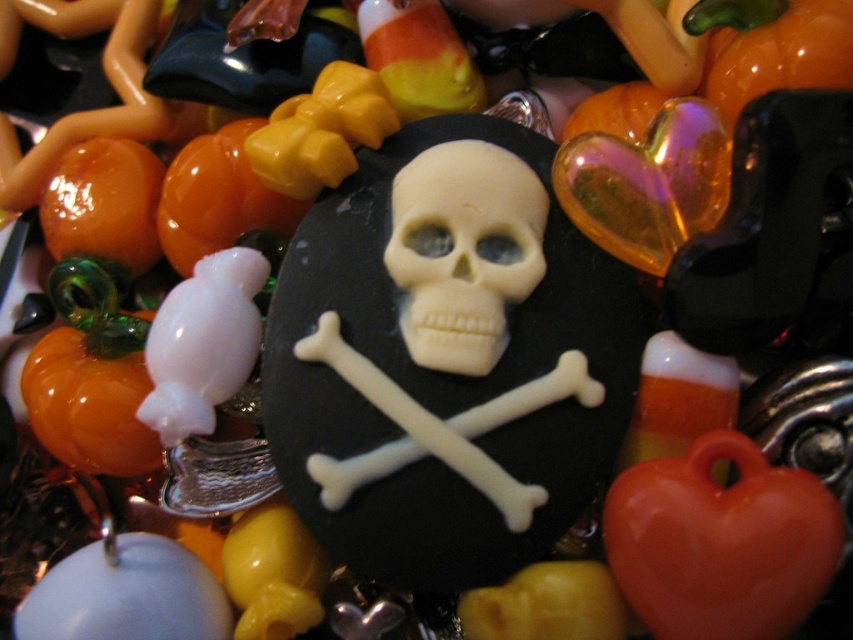
You are organizing a Halloween craft station and need to arrange beads by height. You have a glossy plastic heart at lower right and a white matte skull at center. Which bead should you place first if you want to arrange them from tallest to shortest?

The white matte skull at center is taller than the glossy plastic heart at lower right, so you should place the white matte skull at center first when arranging from tallest to shortest.

You are holding a ruler and want to measure the distance between the glossy plastic heart at lower right and the camera. What is the measured distance?

The distance between the glossy plastic heart at lower right and the camera is 25.22 inches.

You are an artist designing a necklace layout. You have a glossy plastic heart at lower right and a candy corn bead at upper left. Based on their positions, which bead is closer to the bottom edge of the workspace?

The glossy plastic heart at lower right is closer to the bottom edge of the workspace because its y coordinate is 0.845, which is closer to 1.000 than the candy corn bead at upper left.